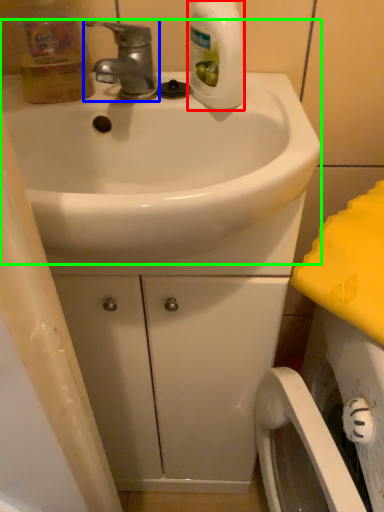
Question: Estimate the real-world distances between objects in this image. Which object is farther from cleaning product (highlighted by a red box), tap (highlighted by a blue box) or sink (highlighted by a green box)?

Choices:
 (A) tap
 (B) sink

Answer: (B)